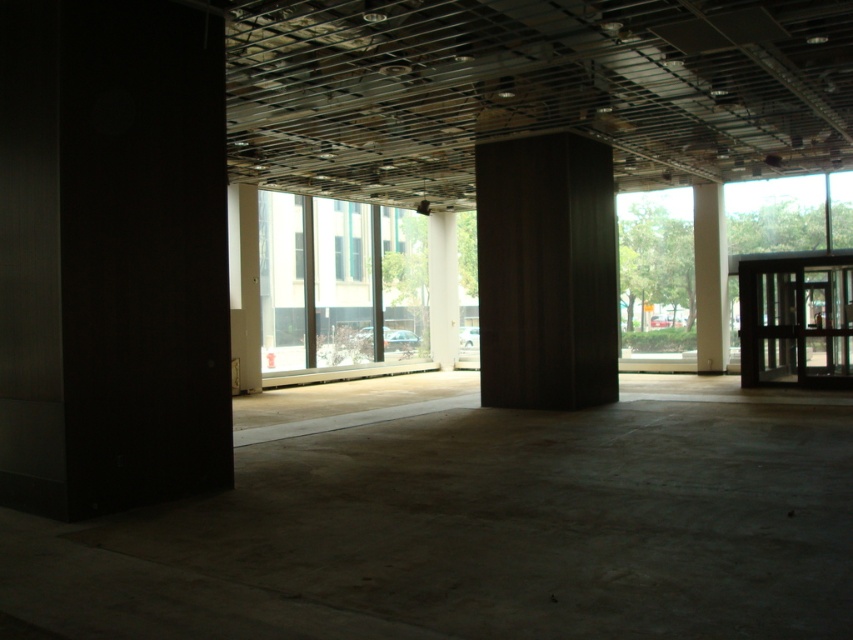
Does transparent glass door at right have a smaller size compared to white smooth pillar at right?

Incorrect, transparent glass door at right is not smaller in size than white smooth pillar at right.

Between transparent glass door at right and white smooth pillar at right, which one has less height?

With less height is transparent glass door at right.

Find the location of a particular element. Image resolution: width=853 pixels, height=640 pixels. transparent glass door at right is located at coordinates (796, 321).

Is dark wood pillar at center further to the viewer compared to transparent glass door at right?

No, dark wood pillar at center is in front of transparent glass door at right.

Can you confirm if dark wood pillar at center is bigger than transparent glass door at right?

Correct, dark wood pillar at center is larger in size than transparent glass door at right.

Who is more forward, (544, 291) or (788, 365)?

Positioned in front is point (544, 291).

Find the location of a particular element. Image resolution: width=853 pixels, height=640 pixels. dark wood pillar at center is located at coordinates (546, 273).

Is dark wood pillar at center above white smooth pillar at right?

No, dark wood pillar at center is not above white smooth pillar at right.

Is dark wood pillar at center further to camera compared to white smooth pillar at right?

No.

This screenshot has height=640, width=853. Describe the element at coordinates (546, 273) in the screenshot. I see `dark wood pillar at center` at that location.

This screenshot has height=640, width=853. What are the coordinates of `dark wood pillar at center` in the screenshot? It's located at (546, 273).